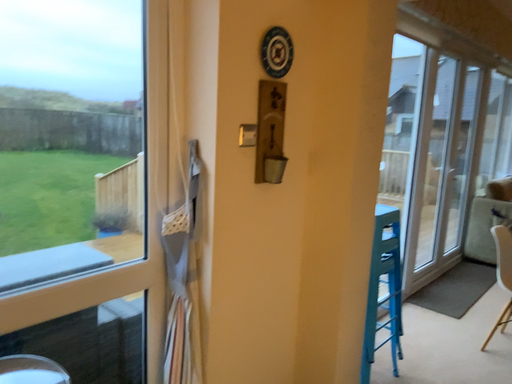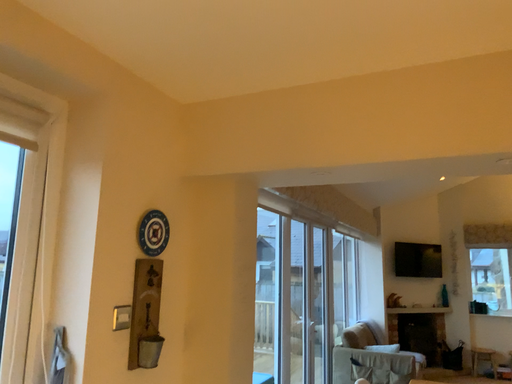
Question: Which way did the camera rotate in the video?

Choices:
 (A) rotated left
 (B) rotated right

Answer: (B)